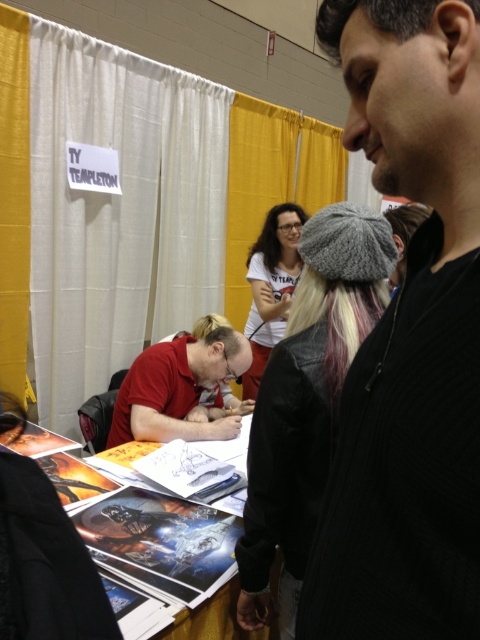
You are standing at the convention booth and want to move from the point at coordinates point (120,385) to the point at coordinates point (250,392). Which direction should you move to get closer to the second point?

To move from point (120,385) to point (250,392), you should move downward because point (250,392) is located below point (120,385).

You are standing at the center of the booth and want to locate the black knit cap at upper right. Which direction should you look to find it?

You should look towards the upper right direction to find the black knit cap at upper right, as it is located at point (x=408, y=340).